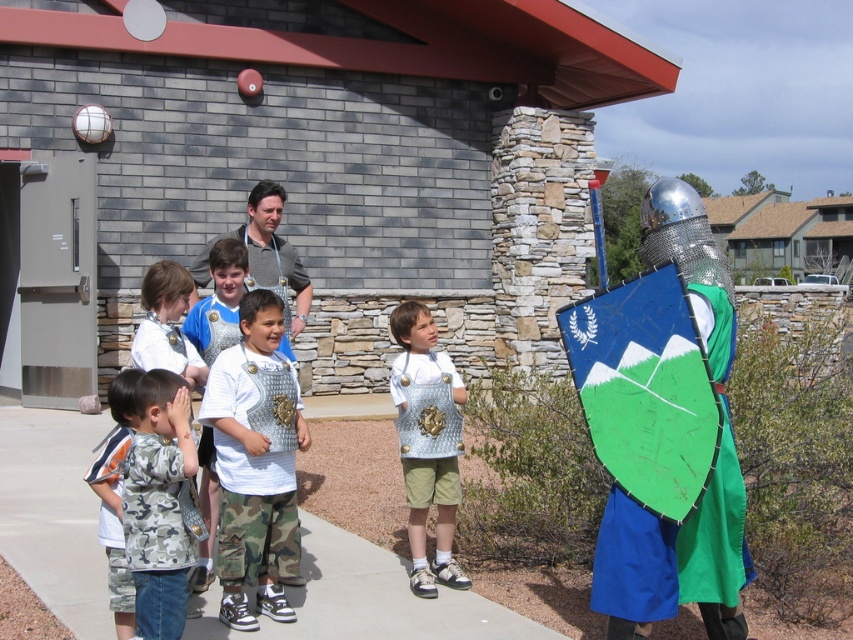
You are a photographer trying to capture a clear shot of the metallic armor at center and the camo fabric shirt at left. Since you want both subjects to be in focus, you need to know their relative positions. Which one is closer to the camera?

The metallic armor at center is positioned over the camo fabric shirt at left, meaning it is closer to the camera.

Consider the image. You are planning to take a photo of the metallic armor at center and the camo fabric shirt at left. Since you want to capture both in the frame, which object should you focus on to ensure both are in focus?

You should focus on the metallic armor at center because its width is larger than the camo fabric shirt at left, so focusing on the wider object will help both be in focus.